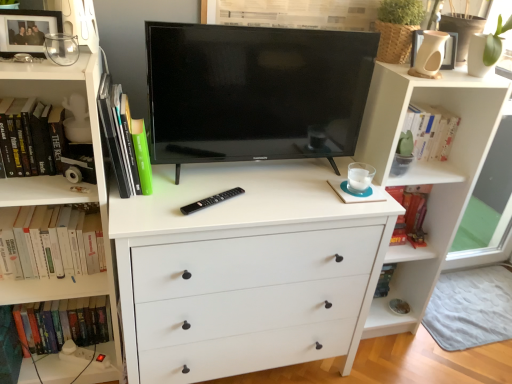
At what (x,y) coordinates should I click in order to perform the action: click on vacant area in front of black glossy tv at center. Please return your answer as a coordinate pair (x, y). This screenshot has width=512, height=384. Looking at the image, I should click on (242, 203).